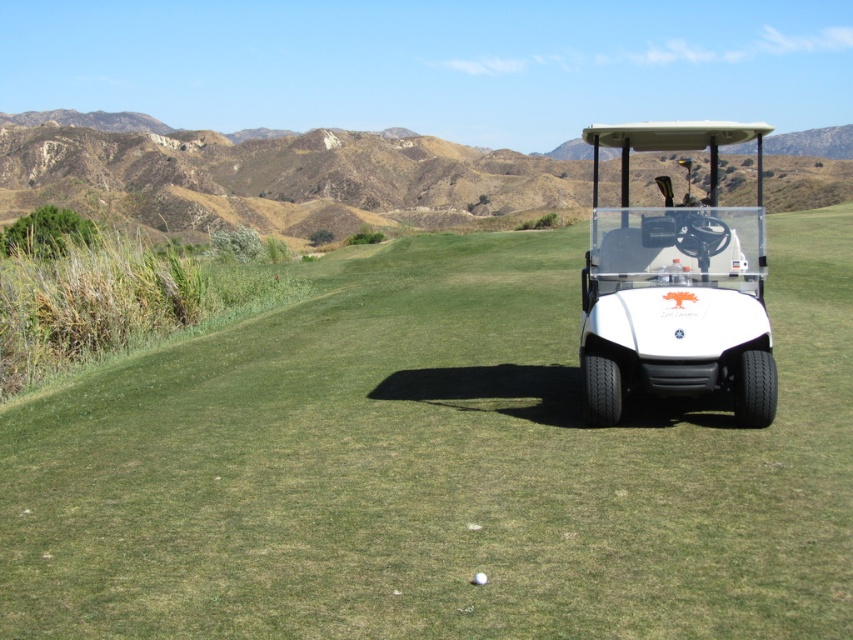
You are standing at the golf cart and want to walk towards the green grassy hill at upper center. What are the coordinates you should head towards?

You should head towards the coordinates point (x=271, y=176) where the green grassy hill at upper center is located.

You are a golfer standing at the edge of the green grass at center and need to reach the white matte golf cart at center. Which direction should you move to get to the cart?

The green grass at center is positioned on the left side of the white matte golf cart at center, so you should move to the right to reach the cart.